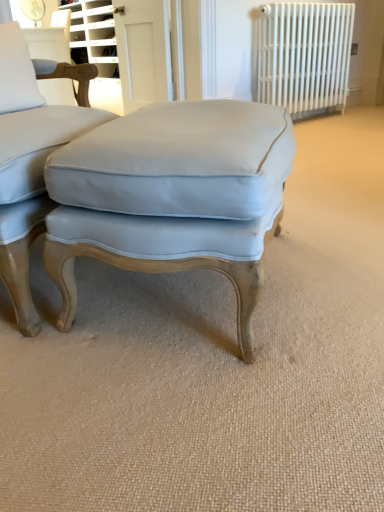
Question: Is white glossy door at upper center aimed at light blue fabric ottoman at center?

Choices:
 (A) no
 (B) yes

Answer: (A)

Question: From a real-world perspective, is white glossy door at upper center under light blue fabric ottoman at center?

Choices:
 (A) no
 (B) yes

Answer: (A)

Question: Is white glossy door at upper center closer to the viewer compared to light blue fabric ottoman at center?

Choices:
 (A) no
 (B) yes

Answer: (A)

Question: Is white glossy door at upper center looking in the opposite direction of light blue fabric ottoman at center?

Choices:
 (A) no
 (B) yes

Answer: (A)

Question: Does white glossy door at upper center have a smaller size compared to light blue fabric ottoman at center?

Choices:
 (A) no
 (B) yes

Answer: (B)

Question: From a real-world perspective, relative to light blue fabric stool at center, is white metal radiator at upper right vertically above or below?

Choices:
 (A) below
 (B) above

Answer: (B)

Question: Is white metal radiator at upper right taller or shorter than light blue fabric stool at center?

Choices:
 (A) short
 (B) tall

Answer: (B)

Question: Which is correct: white metal radiator at upper right is inside light blue fabric stool at center, or outside of it?

Choices:
 (A) outside
 (B) inside

Answer: (A)

Question: Visually, is white metal radiator at upper right positioned to the left or to the right of light blue fabric stool at center?

Choices:
 (A) right
 (B) left

Answer: (A)

Question: Considering the positions of white glossy door at upper center and white metal radiator at upper right in the image, is white glossy door at upper center bigger or smaller than white metal radiator at upper right?

Choices:
 (A) small
 (B) big

Answer: (A)

Question: From the image's perspective, relative to white metal radiator at upper right, is white glossy door at upper center above or below?

Choices:
 (A) above
 (B) below

Answer: (B)

Question: Is point (155, 47) closer or farther from the camera than point (296, 30)?

Choices:
 (A) farther
 (B) closer

Answer: (A)

Question: Based on their positions, is white glossy door at upper center located to the left or right of white metal radiator at upper right?

Choices:
 (A) left
 (B) right

Answer: (A)

Question: Relative to light blue fabric ottoman at center, is white metal radiator at upper right in front or behind?

Choices:
 (A) behind
 (B) front

Answer: (A)

Question: Choose the correct answer: Is white metal radiator at upper right inside light blue fabric ottoman at center or outside it?

Choices:
 (A) inside
 (B) outside

Answer: (B)